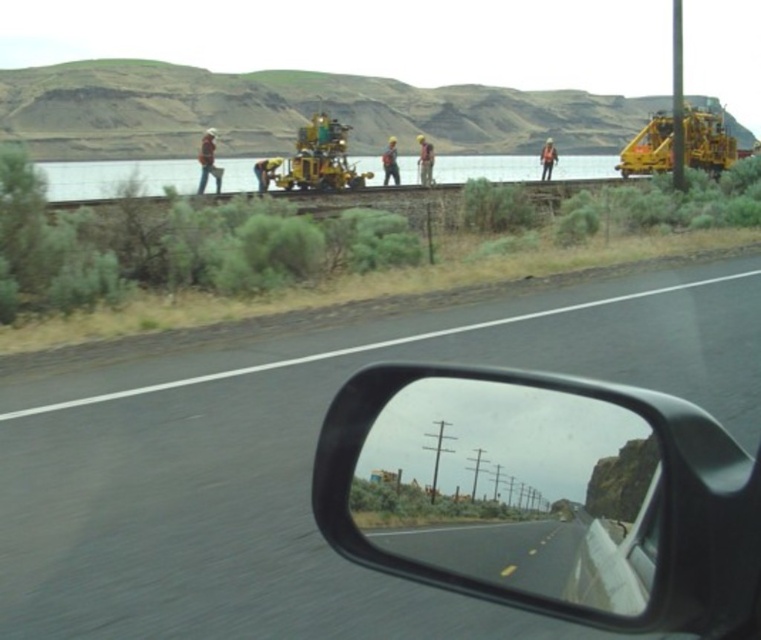
Question: Does black asphalt road at center appear over yellow-green metallic excavator at center?

Choices:
 (A) yes
 (B) no

Answer: (B)

Question: Is black asphalt road at center thinner than smooth reflective mirror at center?

Choices:
 (A) yes
 (B) no

Answer: (B)

Question: Which object is closer to the camera taking this photo?

Choices:
 (A) smooth reflective mirror at center
 (B) black asphalt road at center

Answer: (A)

Question: Which of the following is the closest to the observer?

Choices:
 (A) (342, 138)
 (B) (756, 280)
 (C) (505, 541)

Answer: (C)

Question: Which of these objects is positioned farthest from the black asphalt road at center?

Choices:
 (A) smooth reflective mirror at center
 (B) yellow-green metallic excavator at center

Answer: (B)

Question: Does smooth reflective mirror at center appear on the right side of yellow-green metallic excavator at center?

Choices:
 (A) yes
 (B) no

Answer: (A)